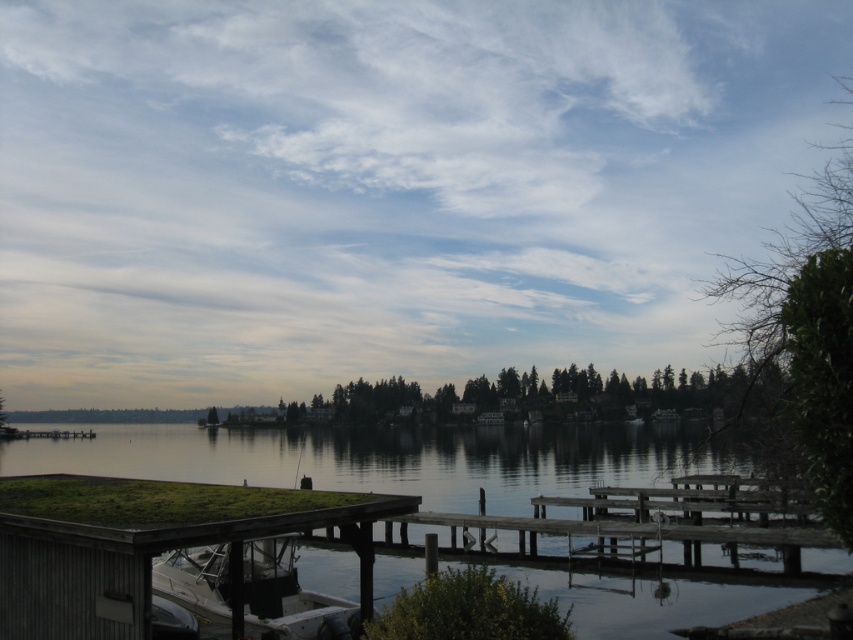
Is clear water at lower center further to camera compared to white matte boat at lower left?

That is True.

Is clear water at lower center smaller than white matte boat at lower left?

Incorrect, clear water at lower center is not smaller in size than white matte boat at lower left.

Which is behind, point (151, 461) or point (265, 548)?

Point (151, 461)

You are a GUI agent. You are given a task and a screenshot of the screen. Output one action in this format:
    pyautogui.click(x=<x>, y=<y>)
    Task: Click on the clear water at lower center
    The image size is (853, 640).
    Given the screenshot: What is the action you would take?
    pyautogui.click(x=384, y=460)